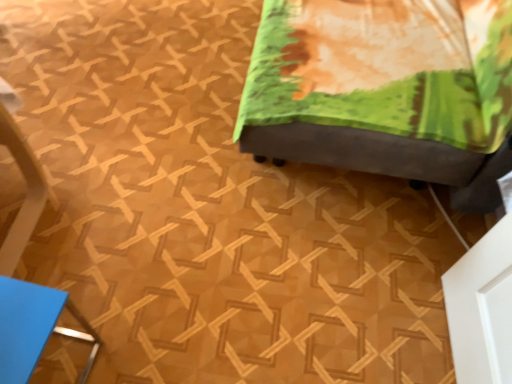
This screenshot has width=512, height=384. Identify the location of vacant area that lies to the right of blue matte folder at lower left, marked as the first furniture in a bottom-to-top arrangement. (133, 342).